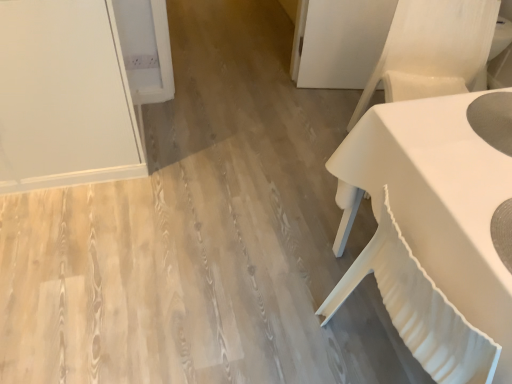
This screenshot has height=384, width=512. Identify the location of white matte table at right. (430, 233).

This screenshot has height=384, width=512. What do you see at coordinates (430, 233) in the screenshot?
I see `white matte table at right` at bounding box center [430, 233].

What do you see at coordinates (432, 50) in the screenshot?
I see `white fabric armchair at right` at bounding box center [432, 50].

Measure the distance between point (349, 124) and camera.

The distance of point (349, 124) from camera is 7.87 feet.

Find the location of `white fabric armchair at right`. white fabric armchair at right is located at coordinates (432, 50).

Where is `white matte table at right`? white matte table at right is located at coordinates (430, 233).

Considering the positions of objects white matte table at right and white fabric armchair at right in the image provided, who is more to the left, white matte table at right or white fabric armchair at right?

white matte table at right.

Is the position of white matte table at right more distant than that of white fabric armchair at right?

No.

Which is farther from the camera, (451,219) or (468,53)?

Point (468,53)

In the scene shown: From the image's perspective, which is above, white matte table at right or white fabric armchair at right?

white fabric armchair at right appears higher in the image.

From a real-world perspective, is white matte table at right beneath white fabric armchair at right?

Yes, from a real-world perspective, white matte table at right is under white fabric armchair at right.

Considering the relative sizes of white matte table at right and white fabric armchair at right in the image provided, is white matte table at right wider than white fabric armchair at right?

Indeed, white matte table at right has a greater width compared to white fabric armchair at right.

Can you confirm if white matte table at right is taller than white fabric armchair at right?

Yes.

Based on the photo, can you confirm if white matte table at right is smaller than white fabric armchair at right?

Incorrect, white matte table at right is not smaller in size than white fabric armchair at right.

Choose the correct answer: Is white matte table at right inside white fabric armchair at right or outside it?

white matte table at right lies outside white fabric armchair at right.

Is white matte table at right far from white fabric armchair at right?

white matte table at right is actually quite close to white fabric armchair at right.

Is white matte table at right looking in the opposite direction of white fabric armchair at right?

No.

How much distance is there between white matte table at right and white fabric armchair at right?

white matte table at right is 33.43 inches away from white fabric armchair at right.

Locate an element on the screen. The height and width of the screenshot is (384, 512). table beneath the white fabric armchair at right (from a real-world perspective) is located at coordinates (430, 233).

Is white fabric armchair at right at the right side of white matte table at right?

Yes, white fabric armchair at right is to the right of white matte table at right.

Is the depth of white fabric armchair at right greater than that of white matte table at right?

Yes, white fabric armchair at right is behind white matte table at right.

Considering the points (419, 18) and (320, 307), which point is behind, point (419, 18) or point (320, 307)?

The point (419, 18) is behind.

From the image's perspective, is white fabric armchair at right under white matte table at right?

No, from the image's perspective, white fabric armchair at right is not below white matte table at right.

In the scene shown: From a real-world perspective, does white fabric armchair at right sit lower than white matte table at right?

No.

Does white fabric armchair at right have a lesser width compared to white matte table at right?

Correct, the width of white fabric armchair at right is less than that of white matte table at right.

Based on the photo, between white fabric armchair at right and white matte table at right, which one has less height?

Standing shorter between the two is white fabric armchair at right.

Is white fabric armchair at right smaller than white matte table at right?

Correct, white fabric armchair at right occupies less space than white matte table at right.

Is white fabric armchair at right completely or partially outside of white matte table at right?

Yes, white fabric armchair at right is located beyond the bounds of white matte table at right.

Is white fabric armchair at right not close to white matte table at right?

No, white fabric armchair at right is not far from white matte table at right.

Is white fabric armchair at right oriented away from white matte table at right?

white fabric armchair at right does not have its back to white matte table at right.

Locate an element on the screen. armchair located on the right of white matte table at right is located at coordinates (432, 50).

At what (x,y) coordinates should I click in order to perform the action: click on armchair behind the white matte table at right. Please return your answer as a coordinate pair (x, y). The image size is (512, 384). Looking at the image, I should click on (432, 50).

At what (x,y) coordinates should I click in order to perform the action: click on table in front of the white fabric armchair at right. Please return your answer as a coordinate pair (x, y). The height and width of the screenshot is (384, 512). Looking at the image, I should click on (430, 233).